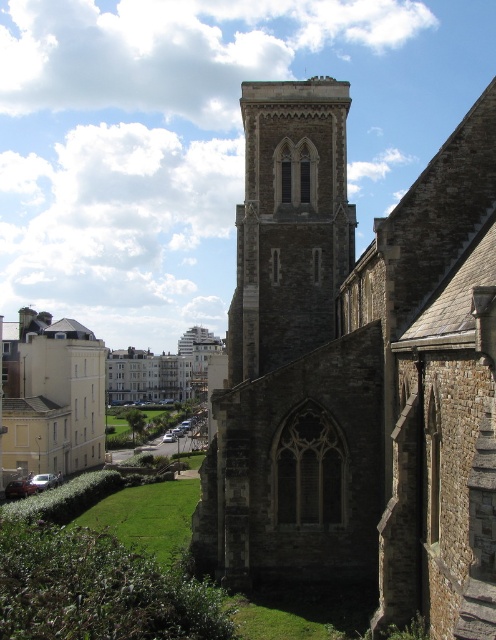
Question: Which of these objects is positioned closest to the brown stone church at center?

Choices:
 (A) white stone building at left
 (B) stone gothic tower at center

Answer: (B)

Question: Where is brown stone church at center located in relation to white stone building at left in the image?

Choices:
 (A) below
 (B) above

Answer: (B)

Question: Is brown stone church at center to the left of white stone building at left from the viewer's perspective?

Choices:
 (A) no
 (B) yes

Answer: (A)

Question: Among these objects, which one is nearest to the camera?

Choices:
 (A) brown stone church at center
 (B) stone gothic tower at center

Answer: (A)

Question: Which object is farther from the camera taking this photo?

Choices:
 (A) white stone building at left
 (B) brown stone church at center

Answer: (A)

Question: Is brown stone church at center positioned at the back of stone gothic tower at center?

Choices:
 (A) no
 (B) yes

Answer: (A)